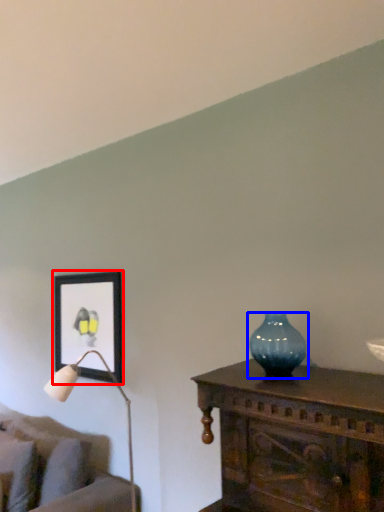
Question: Which object appears closest to the camera in this image, picture frame (highlighted by a red box) or vase (highlighted by a blue box)?

Choices:
 (A) picture frame
 (B) vase

Answer: (B)